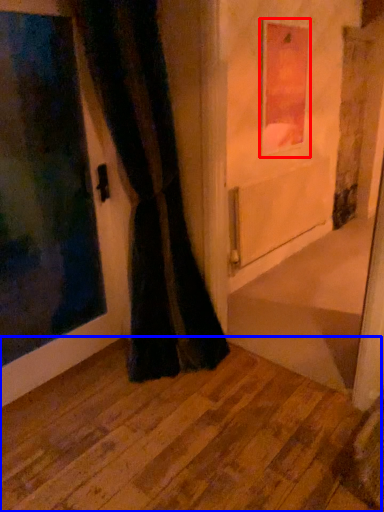
Question: Which object is further to the camera taking this photo, picture frame (highlighted by a red box) or corridor (highlighted by a blue box)?

Choices:
 (A) picture frame
 (B) corridor

Answer: (A)